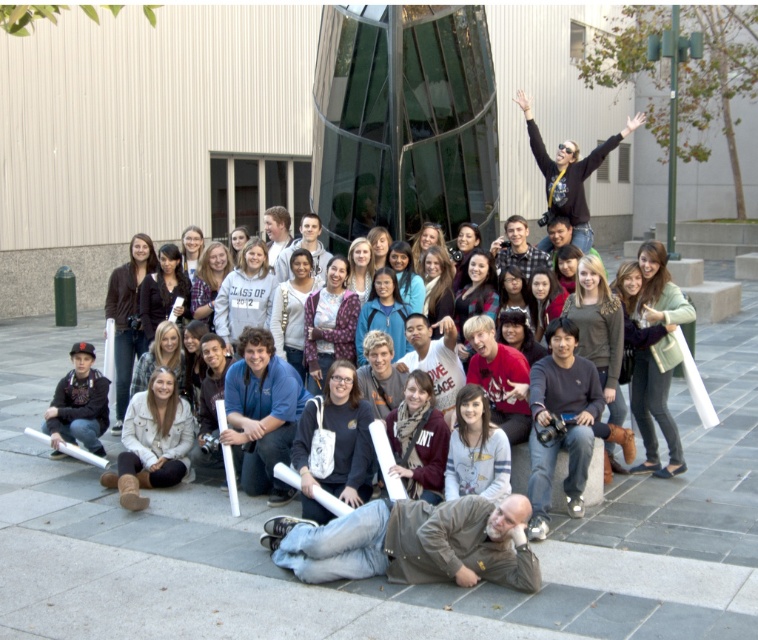
You are standing at the point marked at coordinates (417,544) in the image. What object is directly beneath your feet?

The point at coordinates (417,544) is on the brown leather jacket at lower center, so the object directly beneath your feet is the brown leather jacket at lower center.

You are a photographer standing at the edge of the group. You need to take a photo that includes both the brown leather jacket at lower center and the matte black jacket at center. Given that your camera has a maximum focus range of 5 meters, will you be able to capture both jackets in the same frame without moving?

The brown leather jacket at lower center is 5.03 meters from the matte black jacket at center. Since the distance between them exceeds the camera maximum focus range of 5 meters, you cannot capture both jackets in the same frame without moving.

You are standing in front of the modern building and want to find the brown leather jacket at lower center. What are the coordinates where you can locate it?

The brown leather jacket at lower center is located at coordinates point (417,544).